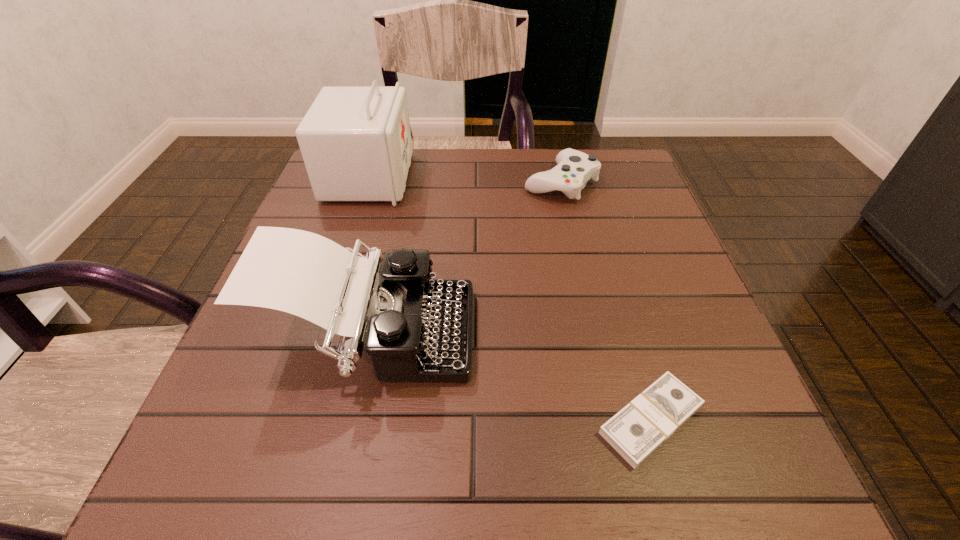
You are a GUI agent. You are given a task and a screenshot of the screen. Output one action in this format:
    pyautogui.click(x=<x>, y=<y>)
    Task: Click on the free point between the shortest object and the second tallest object
    The height and width of the screenshot is (540, 960).
    Given the screenshot: What is the action you would take?
    pyautogui.click(x=512, y=378)

Identify the location of vacant space that's between the first-aid kit and the dollar. Image resolution: width=960 pixels, height=540 pixels. (510, 299).

Choose which object is the third nearest neighbor to the first-aid kit. Please provide its 2D coordinates. Your answer should be formatted as a tuple, i.e. [(x, y)], where the tuple contains the x and y coordinates of a point satisfying the conditions above.

[(638, 429)]

Locate an element on the screen. The width and height of the screenshot is (960, 540). object that can be found as the second closest to the first-aid kit is located at coordinates (574, 168).

Identify the location of free space that satisfies the following two spatial constraints: 1. on the front-facing side of the third tallest object; 2. on the right side of the first-aid kit. This screenshot has width=960, height=540. pyautogui.click(x=368, y=183).

What are the coordinates of `vacant position in the image that satisfies the following two spatial constraints: 1. on the keys of the second tallest object; 2. on the back side of the shortest object` in the screenshot? It's located at (355, 420).

Find the location of a particular element. vacant area in the image that satisfies the following two spatial constraints: 1. on the front-facing side of the first-aid kit; 2. on the left side of the second shortest object is located at coordinates (368, 183).

This screenshot has width=960, height=540. In order to click on free space that satisfies the following two spatial constraints: 1. on the front side of the third tallest object; 2. on the left side of the shortest object in this screenshot , I will do `click(615, 420)`.

Image resolution: width=960 pixels, height=540 pixels. I want to click on vacant area in the image that satisfies the following two spatial constraints: 1. on the back side of the control; 2. on the front-facing side of the tallest object, so click(x=560, y=178).

I want to click on vacant space that satisfies the following two spatial constraints: 1. on the front-facing side of the dollar; 2. on the right side of the first-aid kit, so click(x=290, y=420).